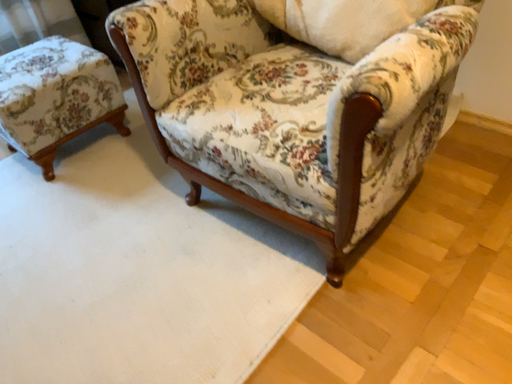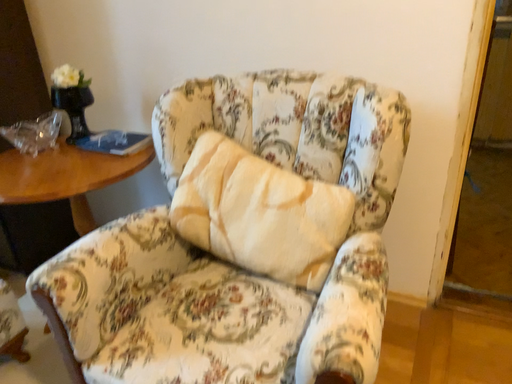
Question: How did the camera likely rotate when shooting the video?

Choices:
 (A) rotated left
 (B) rotated right

Answer: (B)